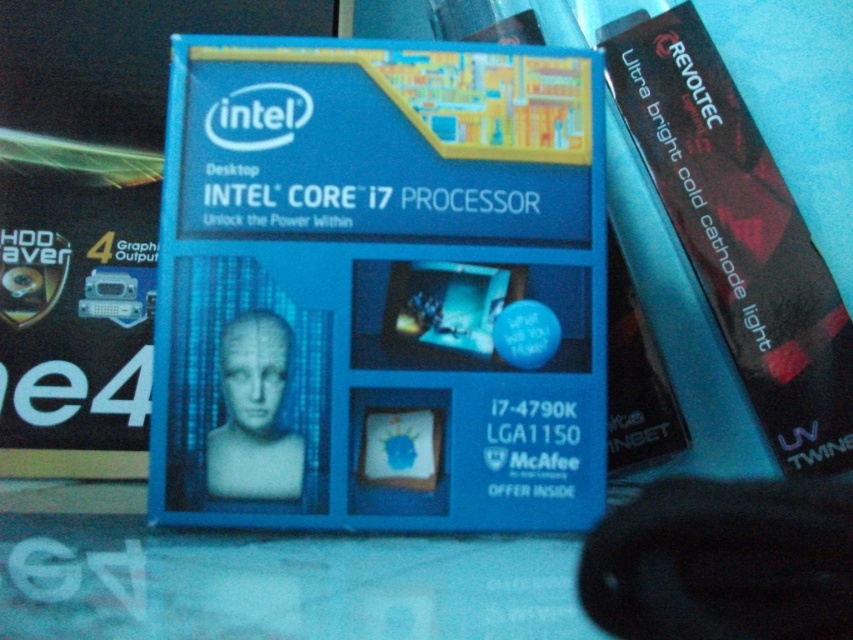
Question: Where is blue cardboard box at center located in relation to black plastic revoltec light at upper right in the image?

Choices:
 (A) left
 (B) right

Answer: (A)

Question: Which of the following is the farthest from the observer?

Choices:
 (A) (611, 60)
 (B) (453, 64)

Answer: (A)

Question: Which point is farther from the camera taking this photo?

Choices:
 (A) (341, 200)
 (B) (763, 426)

Answer: (B)

Question: Can you confirm if blue cardboard box at center is smaller than black plastic revoltec light at upper right?

Choices:
 (A) no
 (B) yes

Answer: (B)

Question: Among these points, which one is farthest from the camera?

Choices:
 (A) (640, 76)
 (B) (602, 291)

Answer: (A)

Question: Is blue cardboard box at center further to camera compared to black plastic revoltec light at upper right?

Choices:
 (A) yes
 (B) no

Answer: (B)